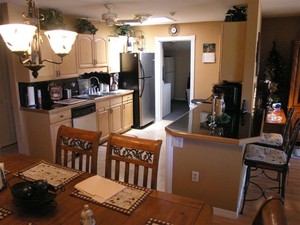
I want to click on placemats, so click(x=139, y=192), click(x=1, y=212), click(x=154, y=222).